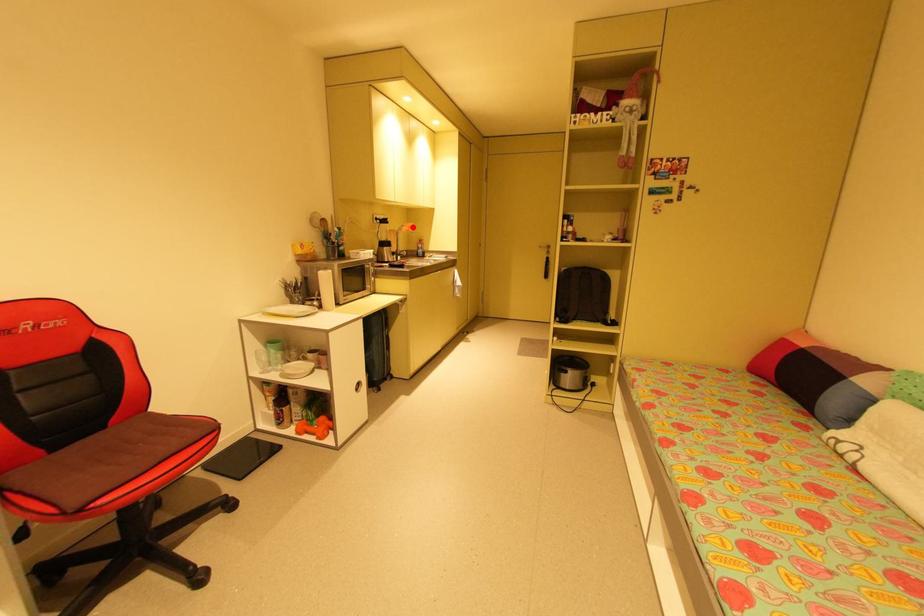
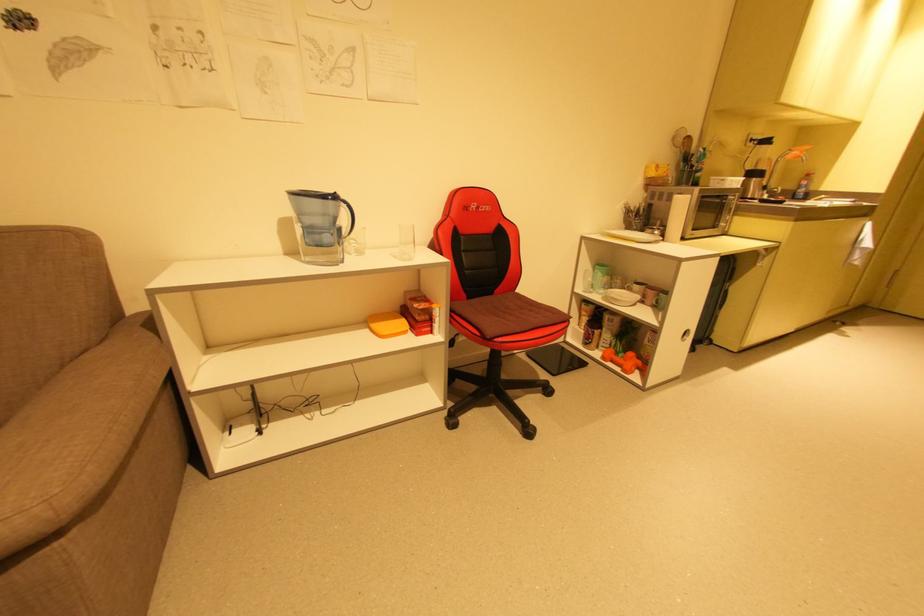
Question: I am providing you with two images of the same scene from different viewpoints. Given a red point in image1, look at the same physical point in image2. Is it:

Choices:
 (A) Closer to the viewpoint
 (B) Farther from the viewpoint

Answer: (B)